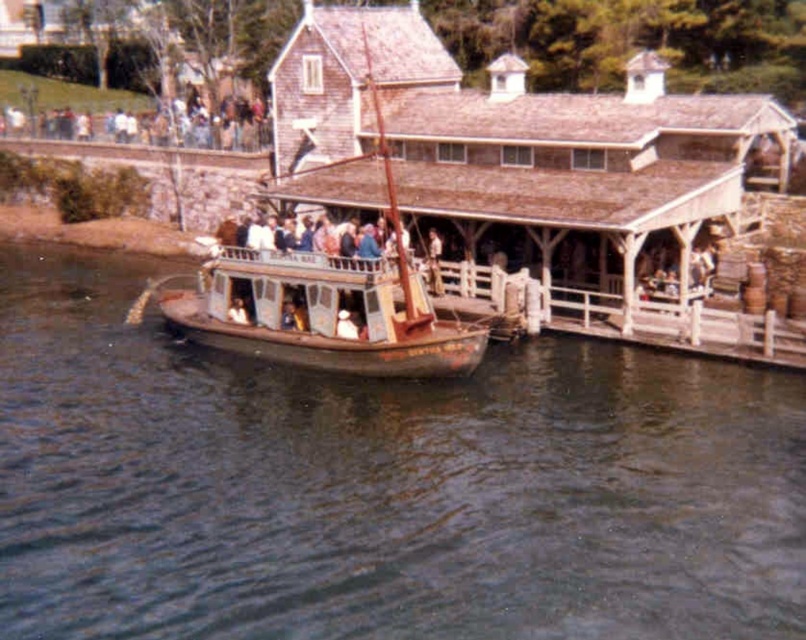
You are a passenger on the rusty wooden boat at center and want to disembark. Which direction should you walk to reach the pier? The pier is located where the brown water at lower center is not present.

Since the brown water at lower center is to the right of the rusty wooden boat at center, you should walk to the left to reach the pier, as the pier is where the brown water is not present.